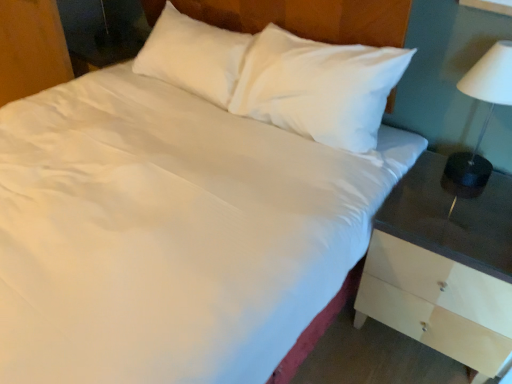
I want to click on vacant area that is in front of white glossy lampshade at right, so click(x=470, y=211).